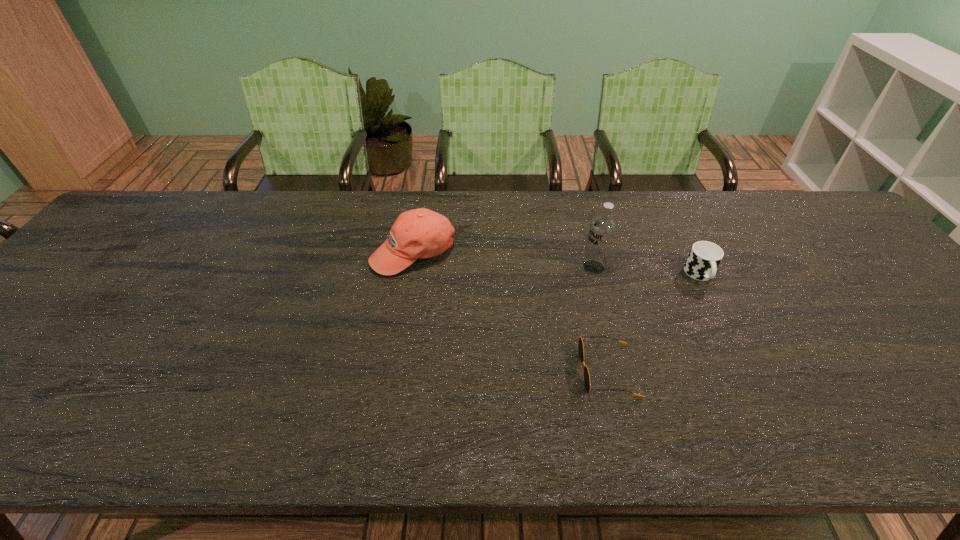
Find the location of a particular element. vodka is located at coordinates (602, 230).

Locate an element on the screen. the leftmost object is located at coordinates (421, 233).

Identify the location of the third shortest object. (421, 233).

Find the location of a particular element. The width and height of the screenshot is (960, 540). the second shortest object is located at coordinates (704, 258).

Where is `cup`? The width and height of the screenshot is (960, 540). cup is located at coordinates (704, 258).

Locate an element on the screen. This screenshot has height=540, width=960. sunglasses is located at coordinates (580, 343).

Image resolution: width=960 pixels, height=540 pixels. In order to click on the shortest object in this screenshot , I will do `click(580, 343)`.

I want to click on vacant area situated on the front label of the vodka, so click(x=483, y=267).

At what (x,y) coordinates should I click in order to perform the action: click on free space located 0.140m on the front label of the vodka. Please return your answer as a coordinate pair (x, y). The width and height of the screenshot is (960, 540). Looking at the image, I should click on (530, 267).

In order to click on free space located 0.130m on the front label of the vodka in this screenshot , I will do `click(534, 267)`.